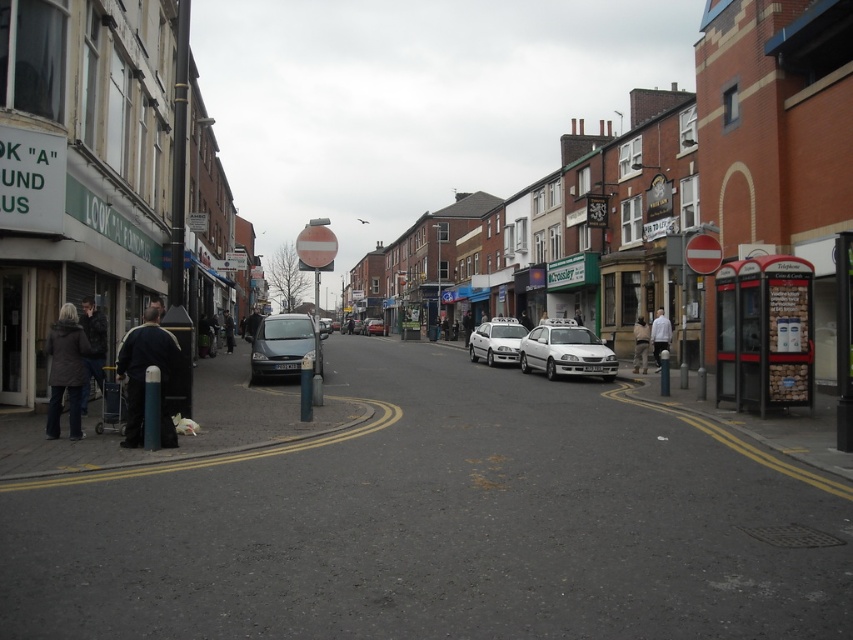
Is point (70, 408) in front of point (669, 333)?

That is True.

Which of these two, dark brown leather jacket at lower left or white matte shirt at center, stands taller?

dark brown leather jacket at lower left

Does point (65, 362) lie behind point (662, 336)?

No, it is not.

Where is `dark brown leather jacket at lower left`? dark brown leather jacket at lower left is located at coordinates (67, 371).

Is brown leather jacket at lower left positioned at the back of white fabric jacket at center?

No, it is not.

I want to click on brown leather jacket at lower left, so click(x=93, y=348).

Can you confirm if brown leather jacket at lower left is shorter than matte silver car at center?

In fact, brown leather jacket at lower left may be taller than matte silver car at center.

How far apart are brown leather jacket at lower left and matte silver car at center?

A distance of 192.95 feet exists between brown leather jacket at lower left and matte silver car at center.

Does point (86, 397) lie behind point (376, 333)?

No.

In order to click on brown leather jacket at lower left in this screenshot , I will do `click(93, 348)`.